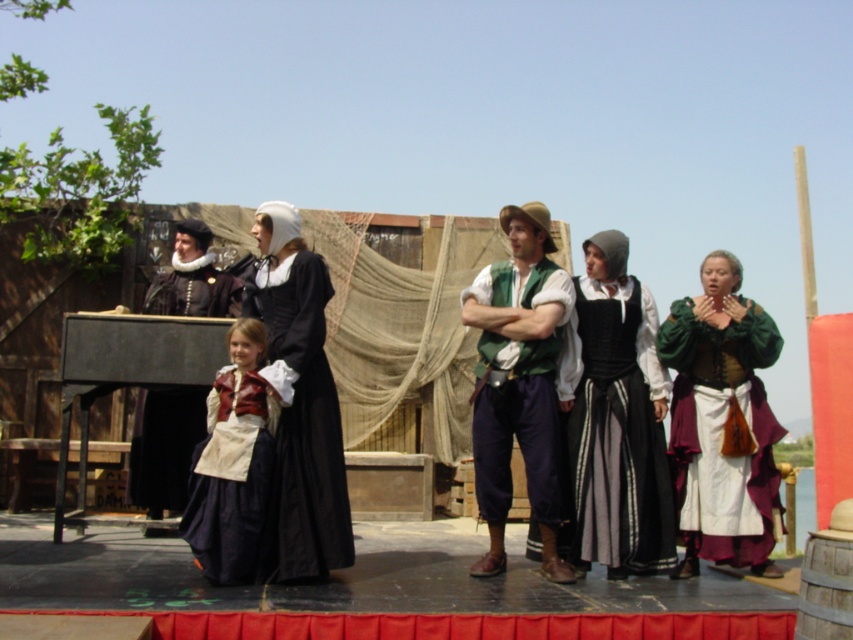
You are a stagehand preparing to move a 4 meter long ladder from the backstage to the front of the stage. You need to pass between the green velvet dress at center and the matte black dress at center. Is there enough space for the ladder to fit through the gap between them?

The green velvet dress at center is 3.99 meters away from the matte black dress at center. Since the ladder is 4 meters long, the gap is slightly smaller than the ladder, so it will not fit through the space between them.